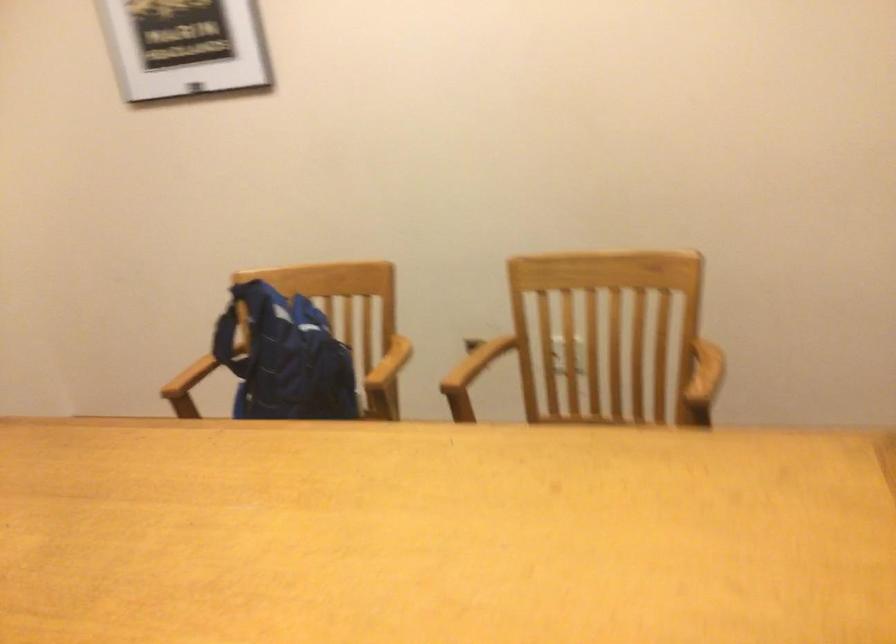
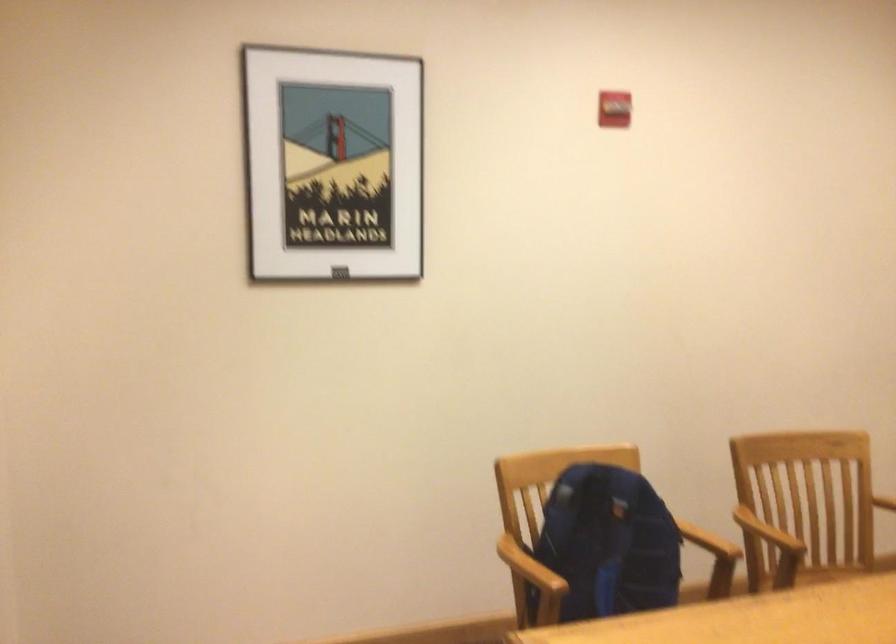
Locate, in the second image, the point that corresponds to pixel 470 357 in the first image.

(767, 532)